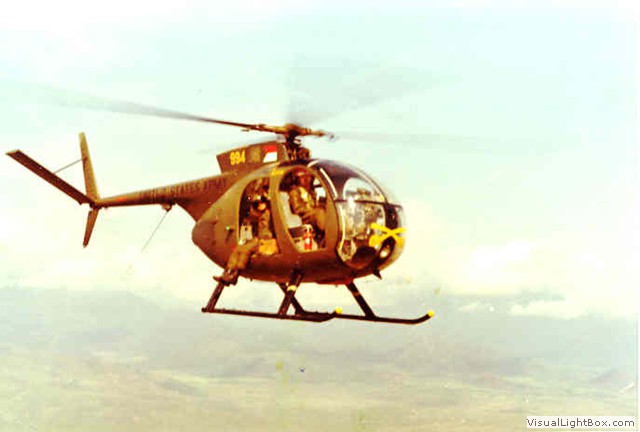
I want to click on doors, so click(289, 211), click(262, 201).